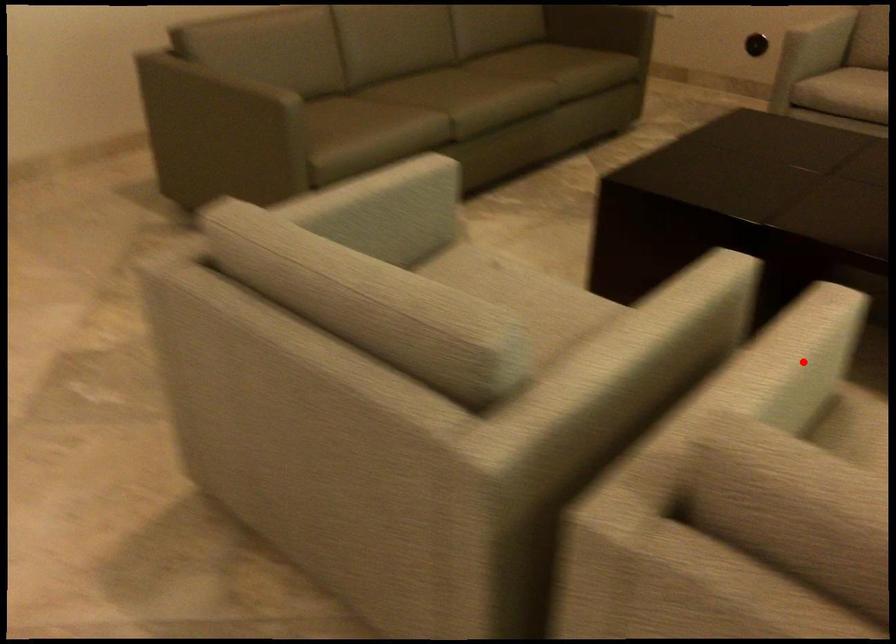
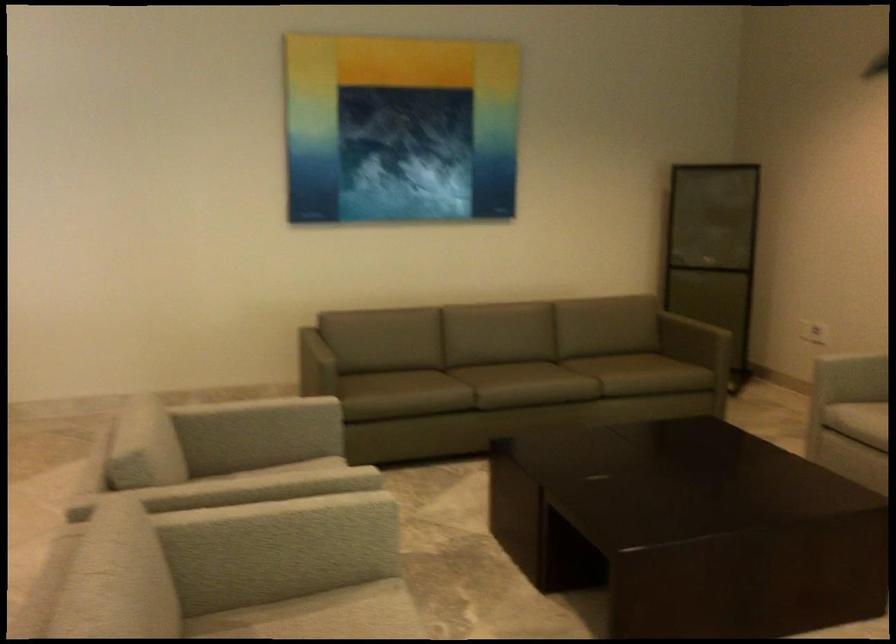
Locate, in the second image, the point that corresponds to the highlighted location in the first image.

(289, 529)